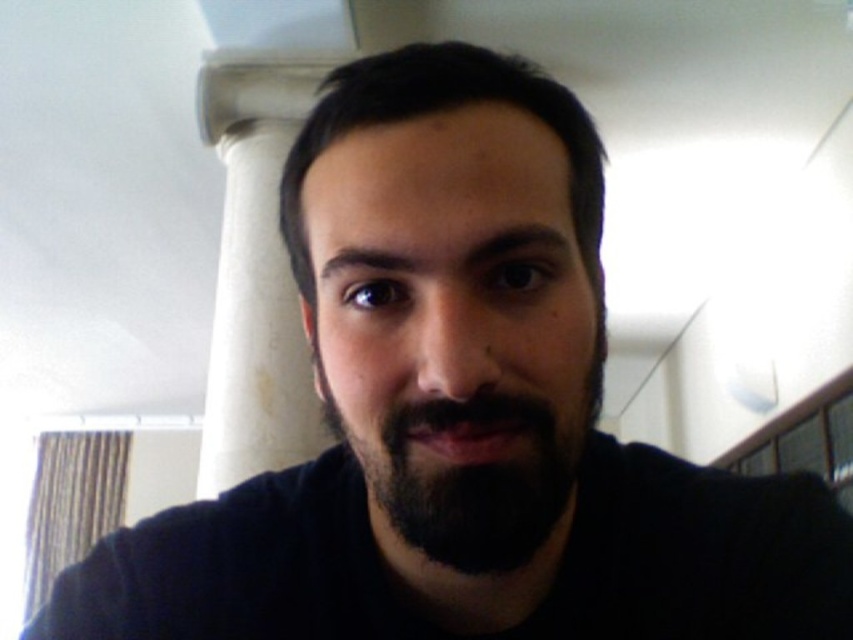
Question: Which of the following is the farthest from the observer?

Choices:
 (A) white marble pillar at upper center
 (B) black fuzzy beard at center

Answer: (A)

Question: Does white marble pillar at upper center come behind black fuzzy beard at center?

Choices:
 (A) yes
 (B) no

Answer: (A)

Question: Does white marble pillar at upper center have a smaller size compared to black fuzzy beard at center?

Choices:
 (A) yes
 (B) no

Answer: (B)

Question: Which object is farther from the camera taking this photo?

Choices:
 (A) black fuzzy beard at center
 (B) white marble pillar at upper center

Answer: (B)

Question: Can you confirm if white marble pillar at upper center is thinner than black fuzzy beard at center?

Choices:
 (A) no
 (B) yes

Answer: (A)

Question: Which object appears closest to the camera in this image?

Choices:
 (A) white marble pillar at upper center
 (B) black fuzzy beard at center

Answer: (B)